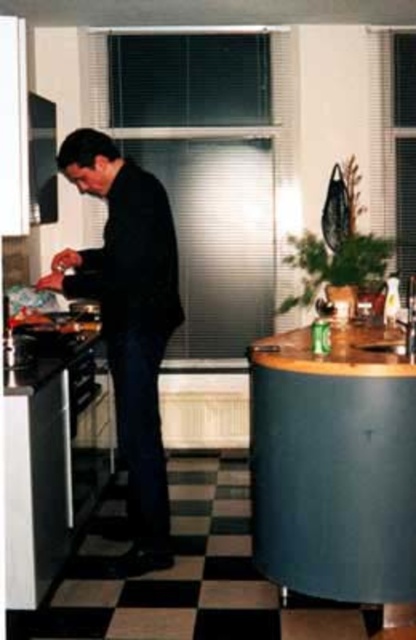
You are a chef standing in the kitchen. You need to place a small bowl on the wooden laminate counter at right and the black matte suit at center. Which surface can you place the bowl on?

The wooden laminate counter at right is below the black matte suit at center, so you can place the bowl on the wooden laminate counter at right since it is a surface.

You are a chef preparing to place a tall bowl on the wooden laminate counter at right and the black matte suit at center. Which surface is shorter and thus unsuitable for the bowl?

The wooden laminate counter at right is shorter than the black matte suit at center, so it is unsuitable for the tall bowl.

You are a tailor measuring a man for a new suit. The man is standing in the kitchen scene described. The tailor needs to know if the black matte suit at center will fit through the doorway leading to the adjacent room. The doorway is as wide as the brown wood counter at right. Will the suit fit through the doorway?

The black matte suit at center has a width less than the brown wood counter at right, which is the width of the doorway. Therefore, the suit will fit through the doorway.